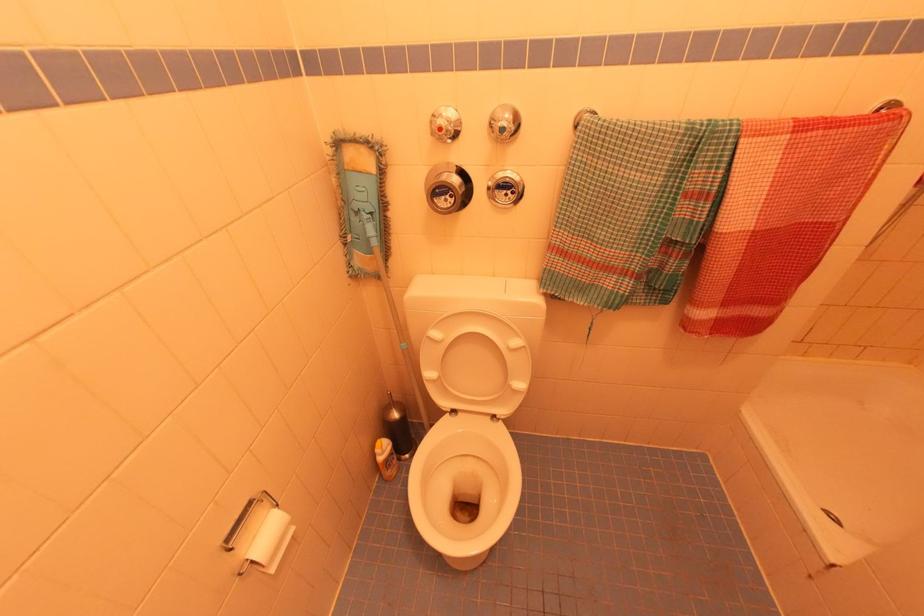
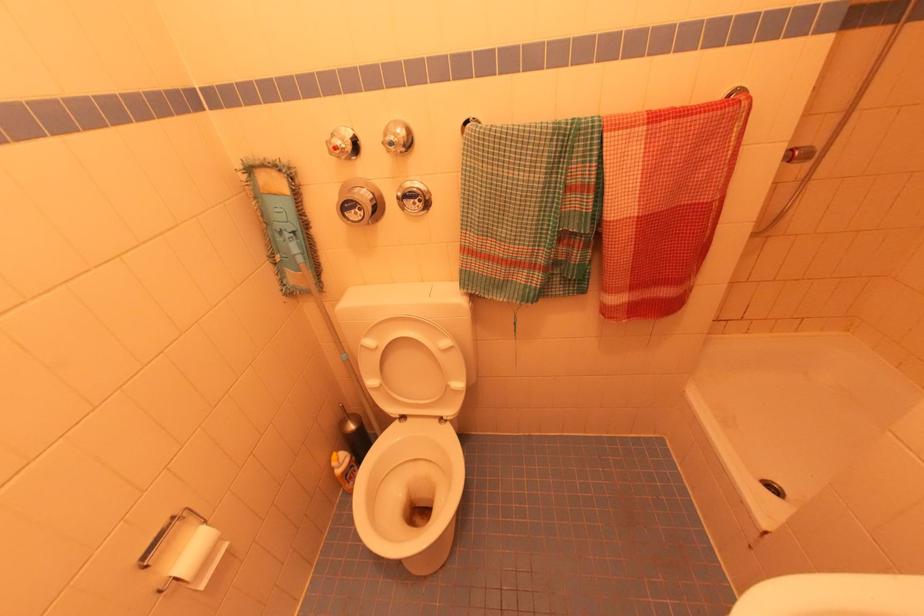
Question: The images are taken continuously from a first-person perspective. In which direction is your viewpoint rotating?

Choices:
 (A) Left
 (B) Right
 (C) Up
 (D) Down

Answer: (C)